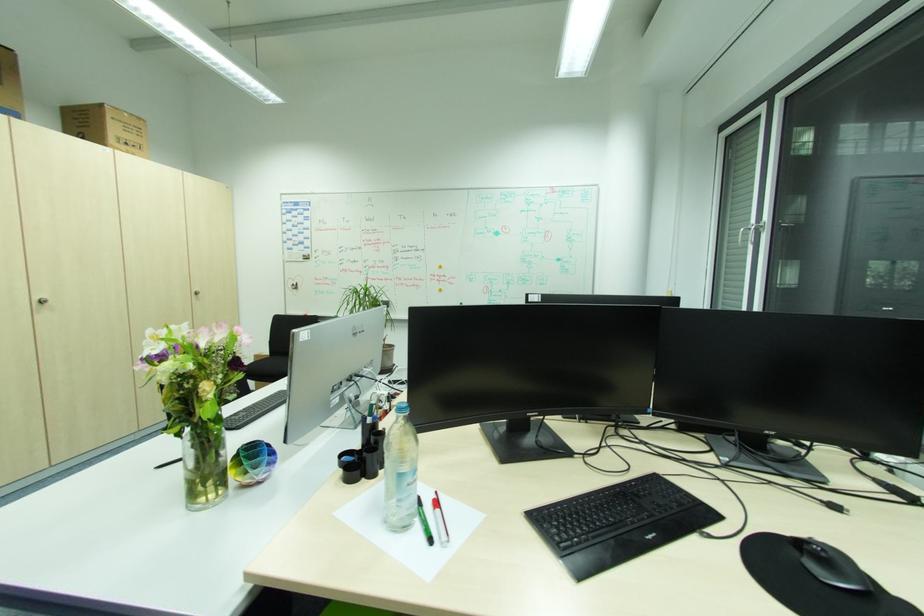
This screenshot has width=924, height=616. I want to click on cardboard box, so click(x=102, y=123).